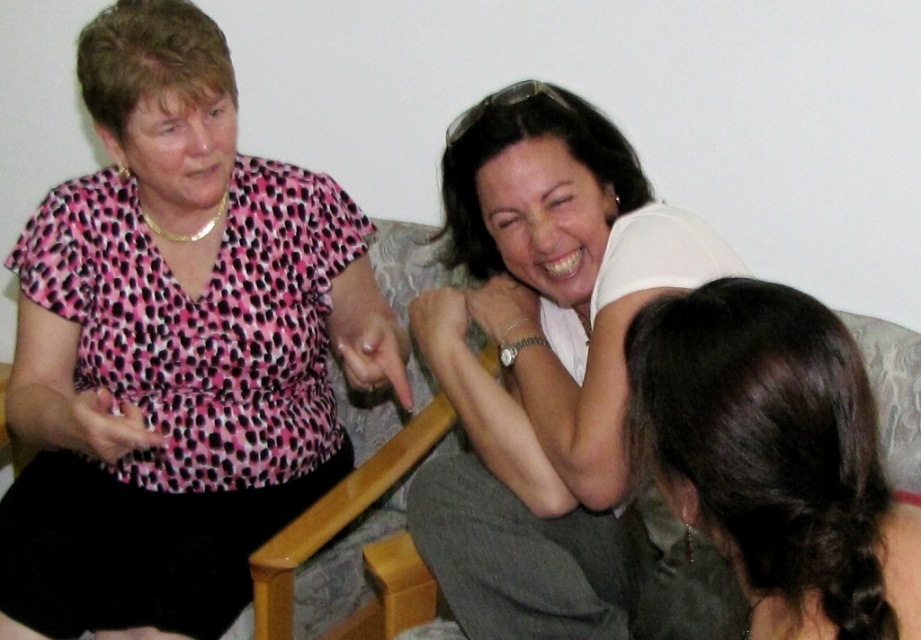
Consider the image. You are standing in the room where the three women are seated. You notice two points marked in the image. One is at coordinates point (x=10, y=580) and the other at point (x=414, y=273). Which of these two points is nearer to you?

The point at coordinates point (x=10, y=580) is closer to the viewer than point (x=414, y=273).

You are standing at the origin point in the image. Which of the two points, point (125, 408) or point (878, 548), is farther away from you?

Point (878, 548) is farther away from you because it is behind point (125, 408).

You are a photographer trying to capture a candid shot of the three women. You notice the pink dotted blouse at left and the dark brown hair at center. Based on their positions, which object might block your view of the other if you frame the shot from the right side?

The pink dotted blouse at left might block the view of the dark brown hair at center if framed from the right side, as it could be wider than the dark brown hair at center.